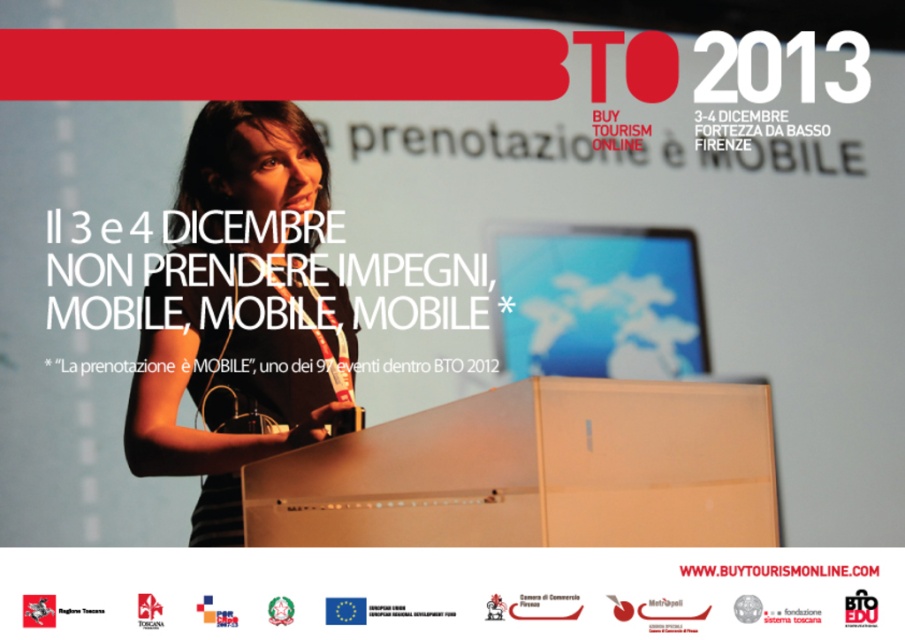
Question: Considering the relative positions of white glossy podium at center and white glossy website at upper center in the image provided, where is white glossy podium at center located with respect to white glossy website at upper center?

Choices:
 (A) right
 (B) left

Answer: (A)

Question: Among these objects, which one is nearest to the camera?

Choices:
 (A) matte black laptop at upper center
 (B) white paper at upper center

Answer: (A)

Question: Which of the following is the farthest from the observer?

Choices:
 (A) (422, 611)
 (B) (815, 609)
 (C) (764, 520)

Answer: (B)

Question: Among these objects, which one is nearest to the camera?

Choices:
 (A) white glossy website at upper center
 (B) white paper at upper center

Answer: (A)

Question: Does matte black laptop at upper center appear over white glossy website at upper center?

Choices:
 (A) no
 (B) yes

Answer: (B)

Question: Is white glossy podium at center above white paper at upper center?

Choices:
 (A) yes
 (B) no

Answer: (A)